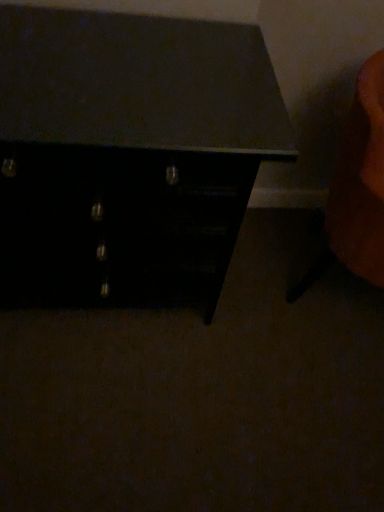
This screenshot has height=512, width=384. Identify the location of matte black chest of drawers at center. (128, 155).

Describe the element at coordinates (128, 155) in the screenshot. I see `matte black chest of drawers at center` at that location.

Locate an element on the screen. Image resolution: width=384 pixels, height=512 pixels. orange fabric swivel chair at right is located at coordinates (357, 188).

Describe the element at coordinates (357, 188) in the screenshot. I see `orange fabric swivel chair at right` at that location.

Where is `matte black chest of drawers at center`? The image size is (384, 512). matte black chest of drawers at center is located at coordinates (128, 155).

Considering the relative positions of orange fabric swivel chair at right and matte black chest of drawers at center in the image provided, is orange fabric swivel chair at right to the left or to the right of matte black chest of drawers at center?

In the image, orange fabric swivel chair at right appears on the right side of matte black chest of drawers at center.

In the image, is orange fabric swivel chair at right positioned in front of or behind matte black chest of drawers at center?

Visually, orange fabric swivel chair at right is located behind matte black chest of drawers at center.

Which point is more forward, (345, 263) or (190, 160)?

Positioned in front is point (190, 160).

From the image's perspective, is orange fabric swivel chair at right above matte black chest of drawers at center?

Incorrect, from the image's perspective, orange fabric swivel chair at right is lower than matte black chest of drawers at center.

From a real-world perspective, which object stands above the other?

matte black chest of drawers at center, from a real-world perspective.

Considering the relative sizes of orange fabric swivel chair at right and matte black chest of drawers at center in the image provided, is orange fabric swivel chair at right wider than matte black chest of drawers at center?

No.

Which of these two, orange fabric swivel chair at right or matte black chest of drawers at center, stands taller?

Standing taller between the two is matte black chest of drawers at center.

Considering the sizes of objects orange fabric swivel chair at right and matte black chest of drawers at center in the image provided, who is bigger, orange fabric swivel chair at right or matte black chest of drawers at center?

With larger size is matte black chest of drawers at center.

Do you think orange fabric swivel chair at right is within matte black chest of drawers at center, or outside of it?

orange fabric swivel chair at right is not inside matte black chest of drawers at center, it's outside.

Would you consider orange fabric swivel chair at right to be distant from matte black chest of drawers at center?

Actually, orange fabric swivel chair at right and matte black chest of drawers at center are a little close together.

Consider the image. Is matte black chest of drawers at center at the back of orange fabric swivel chair at right?

Yes, matte black chest of drawers at center is at the back of orange fabric swivel chair at right.

Measure the distance between orange fabric swivel chair at right and matte black chest of drawers at center.

orange fabric swivel chair at right and matte black chest of drawers at center are 20.82 inches apart from each other.

Identify the location of the chest of drawers in front of the orange fabric swivel chair at right. This screenshot has width=384, height=512. (128, 155).

Based on their positions, is matte black chest of drawers at center located to the left or right of orange fabric swivel chair at right?

Clearly, matte black chest of drawers at center is on the left of orange fabric swivel chair at right in the image.

From the picture: In the image, is matte black chest of drawers at center positioned in front of or behind orange fabric swivel chair at right?

matte black chest of drawers at center is positioned closer to the viewer than orange fabric swivel chair at right.

Which is closer to the camera, (x=92, y=86) or (x=370, y=113)?

Point (x=92, y=86).

From the image's perspective, is matte black chest of drawers at center above or below orange fabric swivel chair at right?

Based on their image positions, matte black chest of drawers at center is located above orange fabric swivel chair at right.

From a real-world perspective, is matte black chest of drawers at center positioned above or below orange fabric swivel chair at right?

matte black chest of drawers at center is situated higher than orange fabric swivel chair at right in the real world.

Is matte black chest of drawers at center thinner than orange fabric swivel chair at right?

No, matte black chest of drawers at center is not thinner than orange fabric swivel chair at right.

Which of these two, matte black chest of drawers at center or orange fabric swivel chair at right, stands taller?

matte black chest of drawers at center is taller.

Considering the sizes of matte black chest of drawers at center and orange fabric swivel chair at right in the image, is matte black chest of drawers at center bigger or smaller than orange fabric swivel chair at right?

Clearly, matte black chest of drawers at center is larger in size than orange fabric swivel chair at right.

Looking at this image, choose the correct answer: Is matte black chest of drawers at center inside orange fabric swivel chair at right or outside it?

matte black chest of drawers at center is not enclosed by orange fabric swivel chair at right.

Is matte black chest of drawers at center next to orange fabric swivel chair at right?

matte black chest of drawers at center is not next to orange fabric swivel chair at right, and they're not touching.

Is matte black chest of drawers at center turned away from orange fabric swivel chair at right?

No, matte black chest of drawers at center's orientation is not away from orange fabric swivel chair at right.

Can you tell me how much matte black chest of drawers at center and orange fabric swivel chair at right differ in facing direction?

They differ by 59.2 degrees in their facing directions.

At what (x,y) coordinates should I click in order to perform the action: click on swivel chair behind the matte black chest of drawers at center. Please return your answer as a coordinate pair (x, y). Looking at the image, I should click on (357, 188).

Where is `the chest of drawers positioned vertically above the orange fabric swivel chair at right (from a real-world perspective)`? This screenshot has height=512, width=384. the chest of drawers positioned vertically above the orange fabric swivel chair at right (from a real-world perspective) is located at coordinates (128, 155).

This screenshot has width=384, height=512. I want to click on the chest of drawers that is above the orange fabric swivel chair at right (from the image's perspective), so click(128, 155).